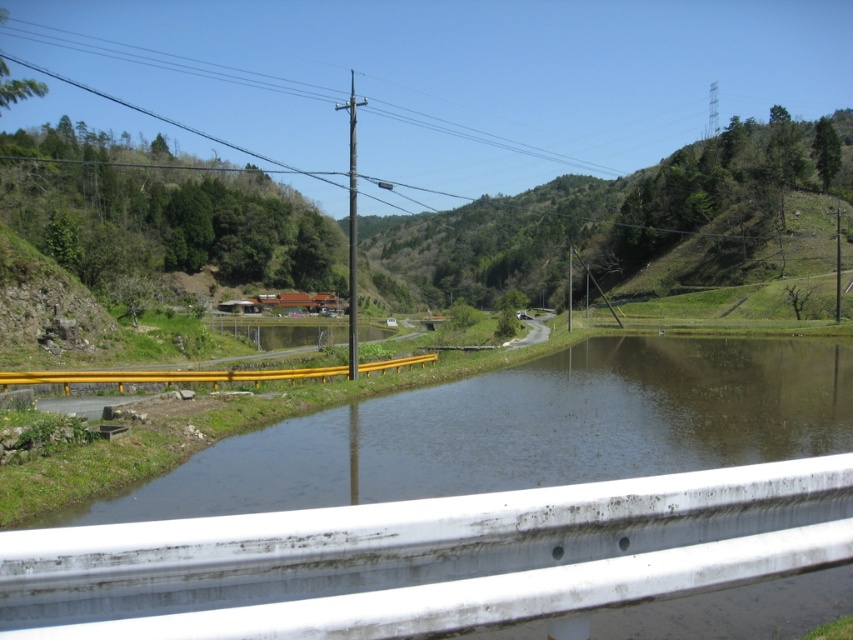
You are standing on the bridge and see the point marked at coordinates (525, 429). What is located at that point?

The point at coordinates (525, 429) corresponds to clear water at lower left.